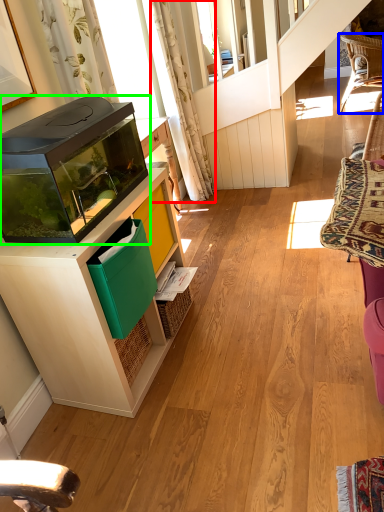
Question: Considering the real-world distances, which object is farthest from curtain (highlighted by a red box)? chair (highlighted by a blue box) or appliance (highlighted by a green box)?

Choices:
 (A) chair
 (B) appliance

Answer: (A)